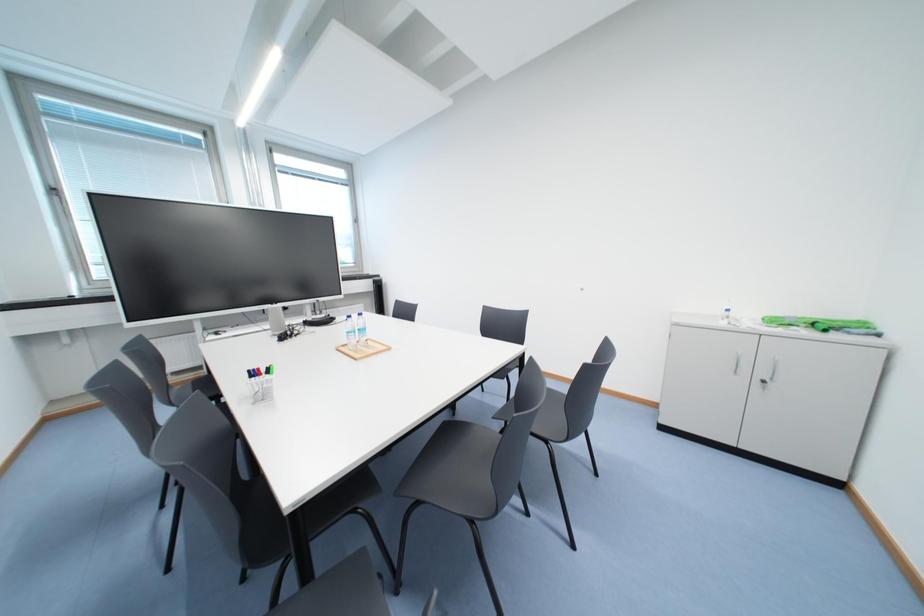
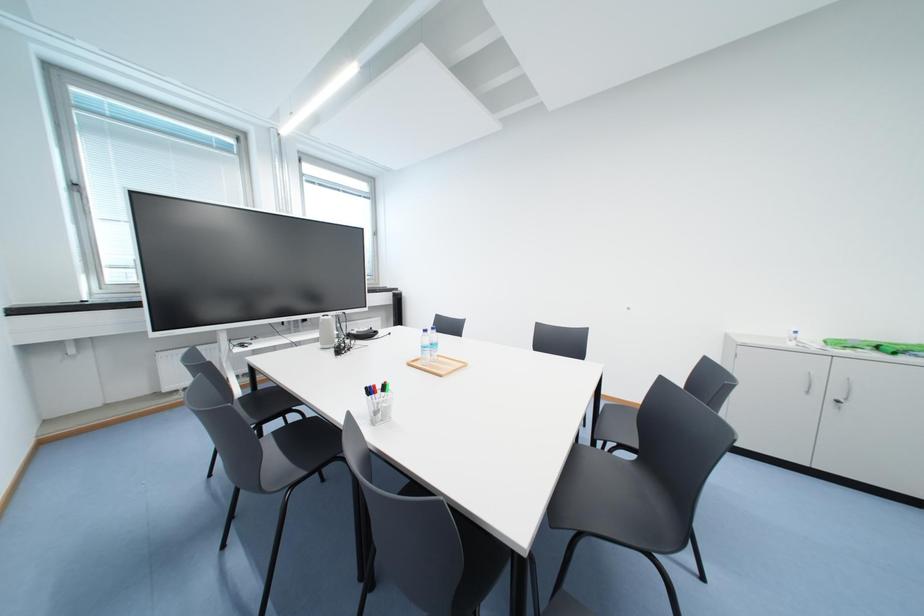
Question: What movement of the cameraman would produce the second image?

Choices:
 (A) Left
 (B) Right
 (C) Forward
 (D) Backward

Answer: (A)